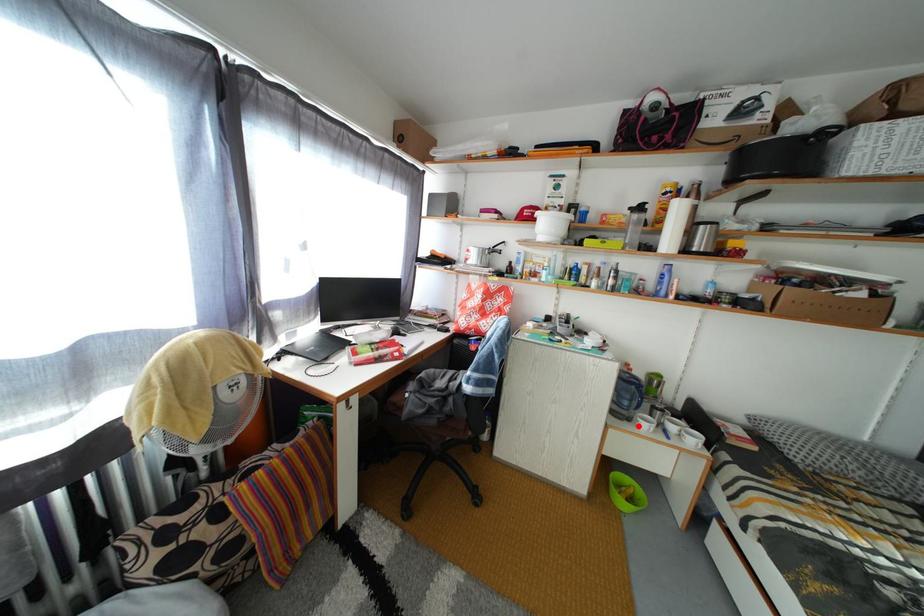
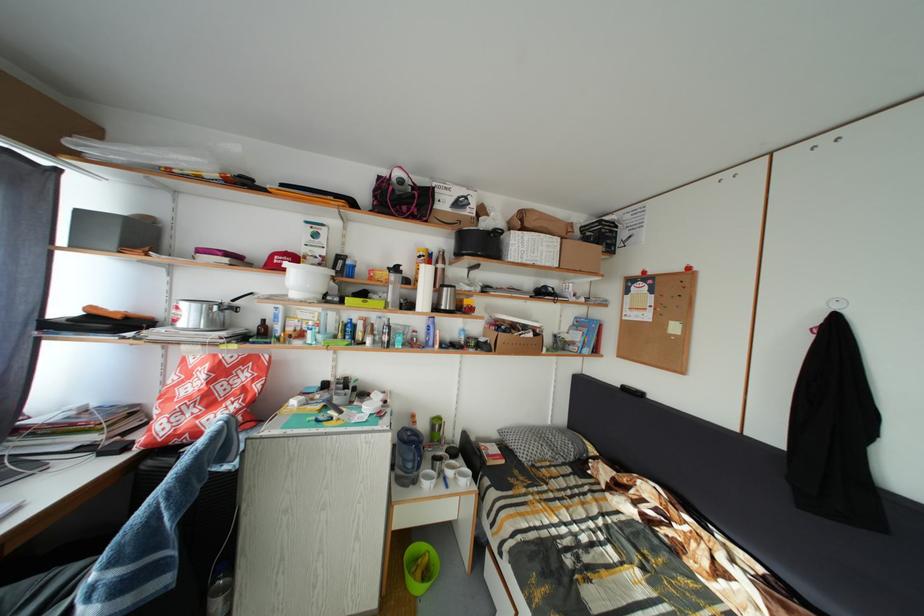
The point at the highlighted location is marked in the first image. Where is the corresponding point in the second image?

(423, 488)